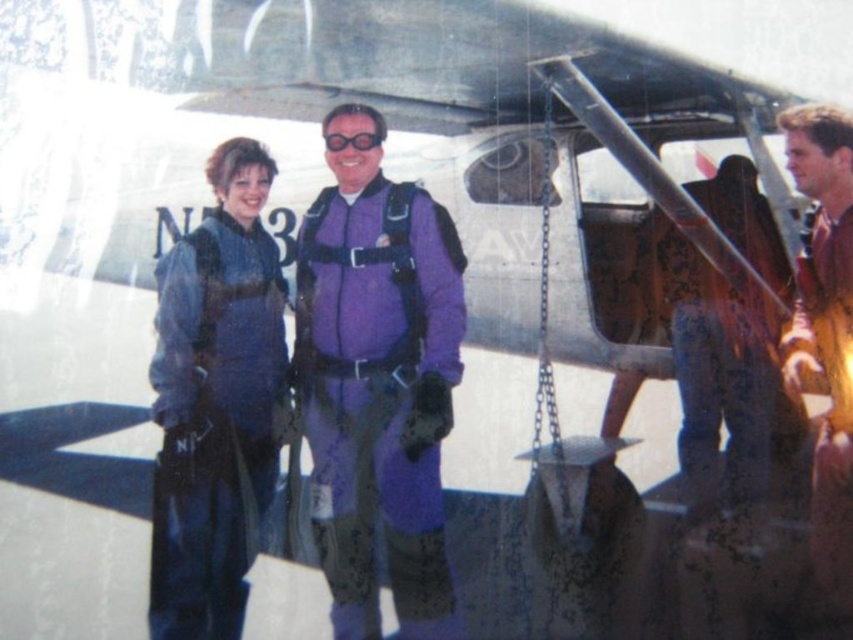
Question: Which of these objects is positioned closest to the purple matte jumpsuit at center?

Choices:
 (A) blue fabric jacket at center
 (B) brown leather jacket at right

Answer: (A)

Question: Which object is the closest to the blue fabric jacket at center?

Choices:
 (A) brown leather jacket at right
 (B) clear plastic goggles at center
 (C) purple matte jumpsuit at center

Answer: (C)

Question: Considering the real-world distances, which object is farthest from the blue fabric jacket at center?

Choices:
 (A) purple matte jumpsuit at center
 (B) clear plastic goggles at center

Answer: (B)

Question: From the image, what is the correct spatial relationship of purple matte jumpsuit at center in relation to brown leather jacket at right?

Choices:
 (A) above
 (B) below

Answer: (B)

Question: Does purple matte jumpsuit at center have a larger size compared to clear plastic goggles at center?

Choices:
 (A) no
 (B) yes

Answer: (B)

Question: In this image, where is purple matte jumpsuit at center located relative to brown leather jacket at right?

Choices:
 (A) right
 (B) left

Answer: (B)